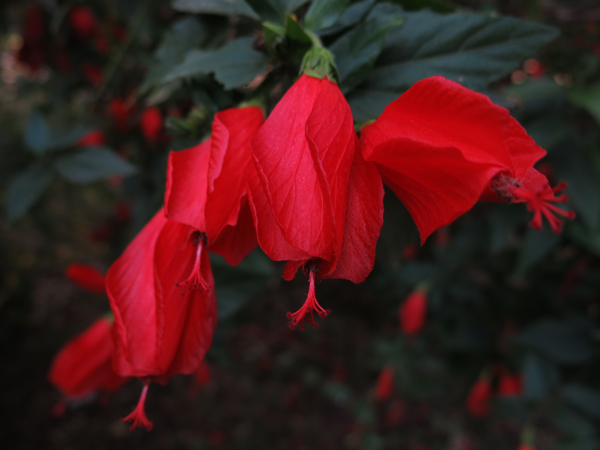
Image resolution: width=600 pixels, height=450 pixels. I want to click on green base of flower, so click(320, 62).